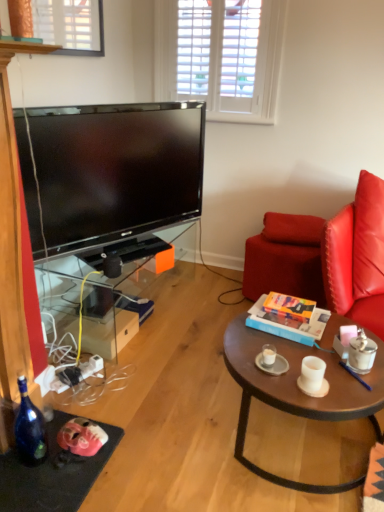
Find the location of `free space that is to the left of white matte coffee cup at center right, placed as the 2th coffee cup when sorted from right to left`. free space that is to the left of white matte coffee cup at center right, placed as the 2th coffee cup when sorted from right to left is located at coordinates (274, 374).